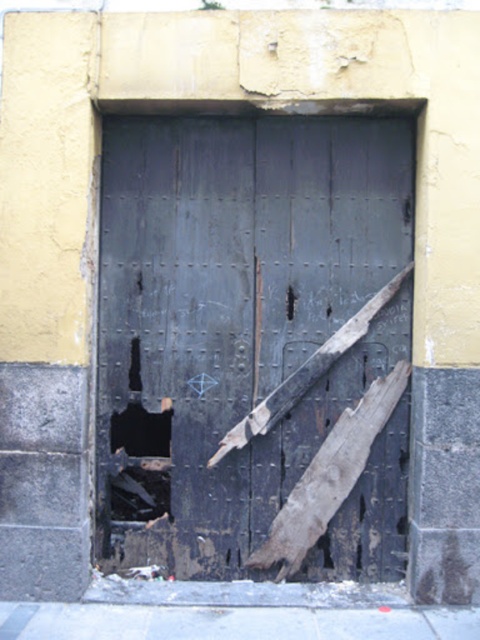
Which of these two, charred wood door at center or rusty metal hole at lower left, stands taller?

charred wood door at center is taller.

Does charred wood door at center have a larger size compared to rusty metal hole at lower left?

Correct, charred wood door at center is larger in size than rusty metal hole at lower left.

This screenshot has height=640, width=480. Find the location of `charred wood door at center`. charred wood door at center is located at coordinates (262, 336).

Can you confirm if rusty metal hole at lower left is wider than black matte hole at center?

No.

Can you confirm if rusty metal hole at lower left is positioned to the right of black matte hole at center?

In fact, rusty metal hole at lower left is to the left of black matte hole at center.

Between point (154, 484) and point (137, 456), which one is positioned behind?

Positioned behind is point (154, 484).

The image size is (480, 640). I want to click on rusty metal hole at lower left, so click(x=140, y=488).

Does charred wood door at center appear under black matte hole at center?

No, charred wood door at center is not below black matte hole at center.

Is point (169, 244) closer to camera compared to point (145, 426)?

Yes, point (169, 244) is closer to viewer.

You are a GUI agent. You are given a task and a screenshot of the screen. Output one action in this format:
    pyautogui.click(x=<x>, y=<y>)
    Task: Click on the charred wood door at center
    This screenshot has height=640, width=480.
    Given the screenshot: What is the action you would take?
    pyautogui.click(x=262, y=336)